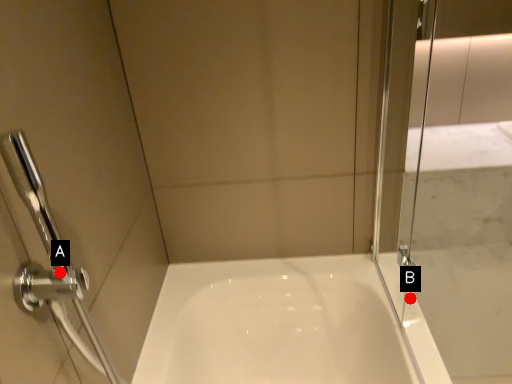
Question: Two points are circled on the image, labeled by A and B beside each circle. Which of the following is the closest to the observer?

Choices:
 (A) A is closer
 (B) B is closer

Answer: (A)